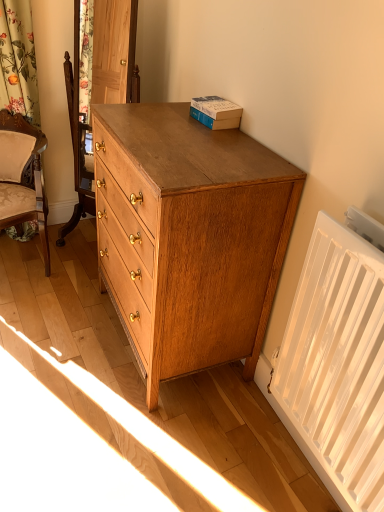
Locate an element on the screen. free region under beige upholstered chair at left (from a real-world perspective) is located at coordinates pyautogui.click(x=31, y=263).